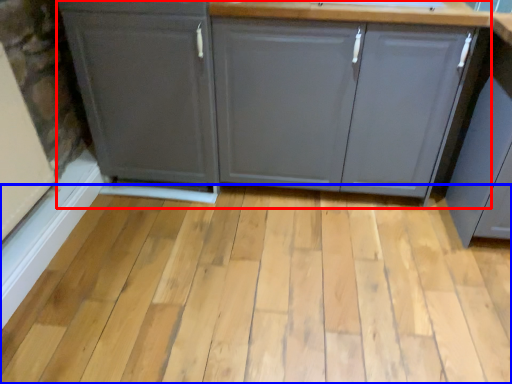
Question: Among these objects, which one is nearest to the camera, cabinetry (highlighted by a red box) or plank (highlighted by a blue box)?

Choices:
 (A) cabinetry
 (B) plank

Answer: (B)